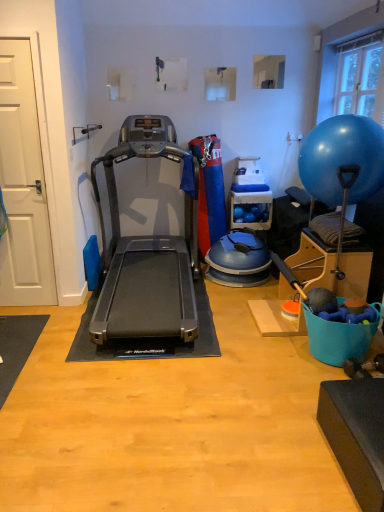
Question: Is black rubber treadmill at center located outside transparent glass window at upper right?

Choices:
 (A) no
 (B) yes

Answer: (B)

Question: Is black rubber treadmill at center smaller than transparent glass window at upper right?

Choices:
 (A) yes
 (B) no

Answer: (B)

Question: Does black rubber treadmill at center have a lesser width compared to transparent glass window at upper right?

Choices:
 (A) no
 (B) yes

Answer: (A)

Question: Is black rubber treadmill at center to the left of transparent glass window at upper right from the viewer's perspective?

Choices:
 (A) yes
 (B) no

Answer: (A)

Question: Is black rubber treadmill at center further to the viewer compared to transparent glass window at upper right?

Choices:
 (A) yes
 (B) no

Answer: (B)

Question: Is white matte door at left spatially inside blue rubber ball at right, or outside of it?

Choices:
 (A) outside
 (B) inside

Answer: (A)

Question: Looking at the image, does white matte door at left seem bigger or smaller compared to blue rubber ball at right?

Choices:
 (A) small
 (B) big

Answer: (A)

Question: Considering their positions, is white matte door at left located in front of or behind blue rubber ball at right?

Choices:
 (A) behind
 (B) front

Answer: (A)

Question: In terms of height, does white matte door at left look taller or shorter compared to blue rubber ball at right?

Choices:
 (A) short
 (B) tall

Answer: (B)

Question: Considering the positions of point (9, 74) and point (112, 224), is point (9, 74) closer or farther from the camera than point (112, 224)?

Choices:
 (A) closer
 (B) farther

Answer: (A)

Question: Looking at the image, does white matte door at left seem bigger or smaller compared to black rubber treadmill at center?

Choices:
 (A) big
 (B) small

Answer: (B)

Question: Choose the correct answer: Is white matte door at left inside black rubber treadmill at center or outside it?

Choices:
 (A) inside
 (B) outside

Answer: (B)

Question: In the image, is white matte door at left on the left side or the right side of black rubber treadmill at center?

Choices:
 (A) right
 (B) left

Answer: (B)

Question: From a real-world perspective, relative to blue rubber ball at right, is transparent glass window at upper right vertically above or below?

Choices:
 (A) above
 (B) below

Answer: (A)

Question: Looking at their shapes, would you say transparent glass window at upper right is wider or thinner than blue rubber ball at right?

Choices:
 (A) wide
 (B) thin

Answer: (B)